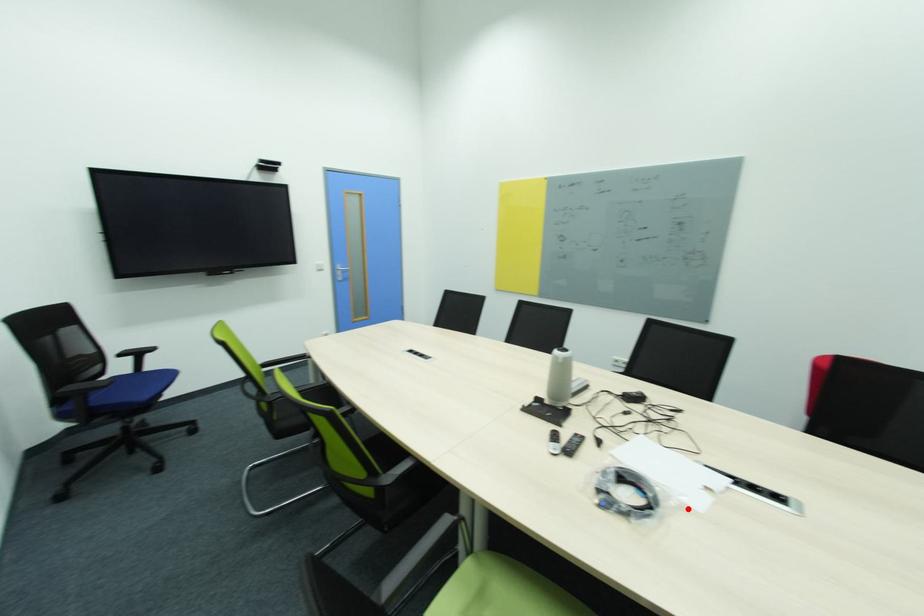
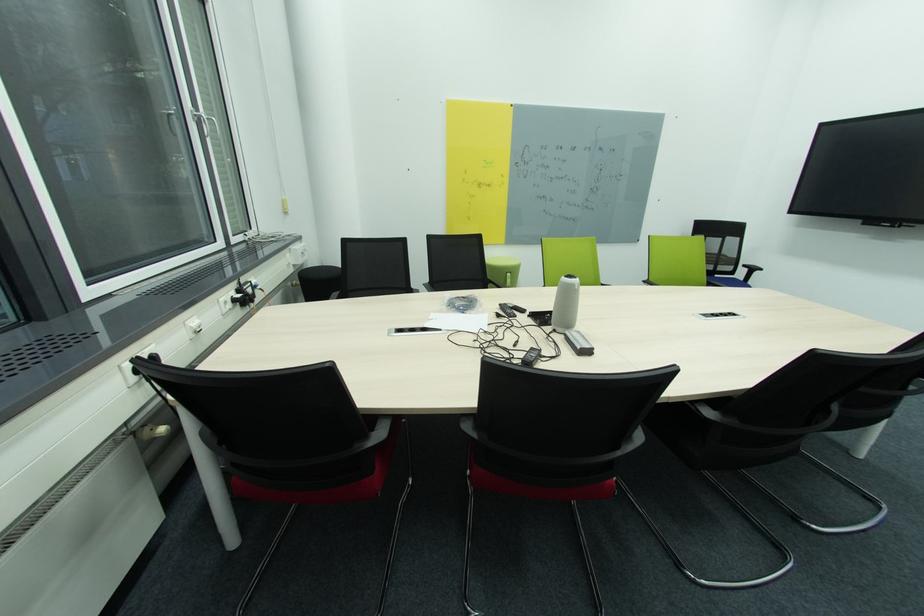
Locate, in the second image, the point that corresponds to the highlighted location in the first image.

(444, 313)